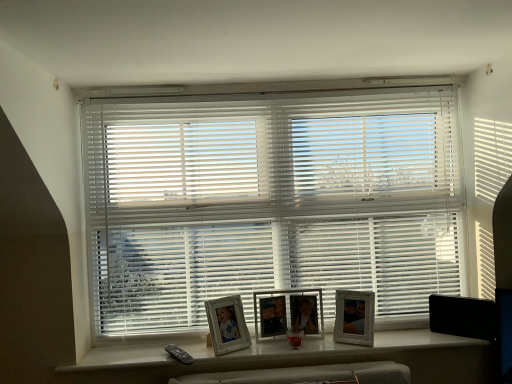
What is the approximate height of white plastic blinds at center?

It is 3.62 feet.

What do you see at coordinates (295, 358) in the screenshot? I see `white plastic frames at center` at bounding box center [295, 358].

Where is `wooden photo frame at center, arranged as the second picture frame when viewed from the left`? wooden photo frame at center, arranged as the second picture frame when viewed from the left is located at coordinates (288, 313).

Find the location of a particular element. white glossy picture frame at center, arranged as the 1th picture frame when viewed from the right is located at coordinates (354, 317).

Can you confirm if white glossy picture frame at center, marked as the third picture frame in a left-to-right arrangement, is positioned to the right of white wooden picture frame at center, which is the first picture frame in left-to-right order?

Yes.

Could you measure the distance between white glossy picture frame at center, marked as the third picture frame in a left-to-right arrangement, and white wooden picture frame at center, the 3th picture frame in the right-to-left sequence?

They are 18.06 inches apart.

From the image's perspective, which one is positioned higher, white glossy picture frame at center, arranged as the 1th picture frame when viewed from the right, or white wooden picture frame at center, which is the first picture frame in left-to-right order?

white glossy picture frame at center, arranged as the 1th picture frame when viewed from the right, from the image's perspective.

Is white plastic frames at center positioned with its back to white glossy picture frame at center, arranged as the 1th picture frame when viewed from the right?

No.

Does point (409, 348) come farther from viewer compared to point (338, 299)?

No, it is in front of (338, 299).

From a real-world perspective, which is physically below, white plastic frames at center or white glossy picture frame at center, arranged as the 1th picture frame when viewed from the right?

white plastic frames at center is physically lower.

Is white wooden picture frame at center, the 3th picture frame in the right-to-left sequence, thinner than white plastic blinds at center?

Indeed, white wooden picture frame at center, the 3th picture frame in the right-to-left sequence, has a lesser width compared to white plastic blinds at center.

From a real-world perspective, is white wooden picture frame at center, which is the first picture frame in left-to-right order, positioned above or below white plastic blinds at center?

white wooden picture frame at center, which is the first picture frame in left-to-right order, is situated lower than white plastic blinds at center in the real world.

Where is `window blind on the right of white wooden picture frame at center, which is the first picture frame in left-to-right order`? window blind on the right of white wooden picture frame at center, which is the first picture frame in left-to-right order is located at coordinates (270, 202).

Would you consider white wooden picture frame at center, which is the first picture frame in left-to-right order, to be distant from white plastic blinds at center?

No, white wooden picture frame at center, which is the first picture frame in left-to-right order, is not far from white plastic blinds at center.

Are white plastic blinds at center and white wooden picture frame at center, the 3th picture frame in the right-to-left sequence, located far from each other?

No, white plastic blinds at center is in close proximity to white wooden picture frame at center, the 3th picture frame in the right-to-left sequence.

From a real-world perspective, which is physically above, white plastic blinds at center or white wooden picture frame at center, which is the first picture frame in left-to-right order?

white plastic blinds at center, from a real-world perspective.

Can you confirm if white plastic blinds at center is smaller than white wooden picture frame at center, which is the first picture frame in left-to-right order?

Incorrect, white plastic blinds at center is not smaller in size than white wooden picture frame at center, which is the first picture frame in left-to-right order.

Considering the relative positions of white plastic blinds at center and white wooden picture frame at center, which is the first picture frame in left-to-right order, in the image provided, is white plastic blinds at center in front of white wooden picture frame at center, which is the first picture frame in left-to-right order,?

No, white plastic blinds at center is further to the viewer.

Looking at this image, which object is positioned more to the right, wooden photo frame at center, placed as the second picture frame when sorted from right to left, or white plastic blinds at center?

From the viewer's perspective, wooden photo frame at center, placed as the second picture frame when sorted from right to left, appears more on the right side.

In the scene shown: Looking at their sizes, would you say wooden photo frame at center, arranged as the second picture frame when viewed from the left, is wider or thinner than white plastic blinds at center?

Considering their sizes, wooden photo frame at center, arranged as the second picture frame when viewed from the left, looks slimmer than white plastic blinds at center.

Is point (295, 305) closer or farther from the camera than point (188, 241)?

Point (295, 305) is positioned closer to the camera compared to point (188, 241).

Looking at this image, between white plastic blinds at center and wooden photo frame at center, arranged as the second picture frame when viewed from the left, which one appears on the left side from the viewer's perspective?

white plastic blinds at center.

Does white plastic blinds at center touch wooden photo frame at center, arranged as the second picture frame when viewed from the left?

No, white plastic blinds at center is not in contact with wooden photo frame at center, arranged as the second picture frame when viewed from the left.

Is white plastic blinds at center inside the boundaries of wooden photo frame at center, placed as the second picture frame when sorted from right to left, or outside?

white plastic blinds at center is located beyond the bounds of wooden photo frame at center, placed as the second picture frame when sorted from right to left.

Does white plastic blinds at center have a greater width compared to wooden photo frame at center, placed as the second picture frame when sorted from right to left?

Yes, white plastic blinds at center is wider than wooden photo frame at center, placed as the second picture frame when sorted from right to left.

Is wooden photo frame at center, arranged as the second picture frame when viewed from the left, oriented towards white wooden picture frame at center, which is the first picture frame in left-to-right order?

No.

Can you tell me how much wooden photo frame at center, placed as the second picture frame when sorted from right to left, and white wooden picture frame at center, the 3th picture frame in the right-to-left sequence, differ in facing direction?

They differ by 29.7 degrees in their facing directions.

Can white wooden picture frame at center, which is the first picture frame in left-to-right order, be found inside wooden photo frame at center, arranged as the second picture frame when viewed from the left?

No, white wooden picture frame at center, which is the first picture frame in left-to-right order, is located outside of wooden photo frame at center, arranged as the second picture frame when viewed from the left.

Looking at this image, which is nearer, [273,308] or [216,355]?

Point [273,308].

From a real-world perspective, starting from the white wooden picture frame at center, which is the first picture frame in left-to-right order, which picture frame is the 1st one vertically above it? Please provide its 2D coordinates.

[(354, 317)]

In order to click on window located underneath the white glossy picture frame at center, arranged as the 1th picture frame when viewed from the right (from a real-world perspective) in this screenshot , I will do `click(295, 358)`.

When comparing their distances from white wooden picture frame at center, the 3th picture frame in the right-to-left sequence, does wooden photo frame at center, placed as the second picture frame when sorted from right to left, or white plastic blinds at center seem closer?

Among the two, wooden photo frame at center, placed as the second picture frame when sorted from right to left, is located nearer to white wooden picture frame at center, the 3th picture frame in the right-to-left sequence.

Estimate the real-world distances between objects in this image. Which object is closer to white plastic frames at center, white glossy picture frame at center, marked as the third picture frame in a left-to-right arrangement, or white plastic blinds at center?

Based on the image, white glossy picture frame at center, marked as the third picture frame in a left-to-right arrangement, appears to be nearer to white plastic frames at center.

When comparing their distances from wooden photo frame at center, arranged as the second picture frame when viewed from the left, does white plastic frames at center or white plastic blinds at center seem closer?

white plastic frames at center is closer to wooden photo frame at center, arranged as the second picture frame when viewed from the left.

Looking at the image, which one is located further to wooden photo frame at center, arranged as the second picture frame when viewed from the left, white glossy picture frame at center, marked as the third picture frame in a left-to-right arrangement, or white plastic frames at center?

Based on the image, white plastic frames at center appears to be further to wooden photo frame at center, arranged as the second picture frame when viewed from the left.

Estimate the real-world distances between objects in this image. Which object is closer to white plastic blinds at center, white plastic frames at center or white glossy picture frame at center, arranged as the 1th picture frame when viewed from the right?

The object closer to white plastic blinds at center is white glossy picture frame at center, arranged as the 1th picture frame when viewed from the right.

When comparing their distances from white glossy picture frame at center, arranged as the 1th picture frame when viewed from the right, does white plastic blinds at center or white wooden picture frame at center, the 3th picture frame in the right-to-left sequence, seem further?

white plastic blinds at center is positioned further to the anchor white glossy picture frame at center, arranged as the 1th picture frame when viewed from the right.

Considering their positions, is white plastic frames at center positioned further to white wooden picture frame at center, the 3th picture frame in the right-to-left sequence, than wooden photo frame at center, arranged as the second picture frame when viewed from the left?

white plastic frames at center lies further to white wooden picture frame at center, the 3th picture frame in the right-to-left sequence, than the other object.

Looking at the image, which one is located further to white plastic blinds at center, wooden photo frame at center, arranged as the second picture frame when viewed from the left, or white plastic frames at center?

white plastic frames at center.

The height and width of the screenshot is (384, 512). In order to click on picture frame situated between white plastic frames at center and white glossy picture frame at center, arranged as the 1th picture frame when viewed from the right, from left to right in this screenshot , I will do `click(288, 313)`.

Where is `window located between white wooden picture frame at center, which is the first picture frame in left-to-right order, and white glossy picture frame at center, marked as the third picture frame in a left-to-right arrangement, in the left-right direction`? This screenshot has height=384, width=512. window located between white wooden picture frame at center, which is the first picture frame in left-to-right order, and white glossy picture frame at center, marked as the third picture frame in a left-to-right arrangement, in the left-right direction is located at coordinates (295, 358).

I want to click on picture frame between white plastic blinds at center and wooden photo frame at center, arranged as the second picture frame when viewed from the left, vertically, so click(354, 317).

Identify the location of window located between white wooden picture frame at center, the 3th picture frame in the right-to-left sequence, and wooden photo frame at center, arranged as the second picture frame when viewed from the left, in the left-right direction. The image size is (512, 384). (295, 358).